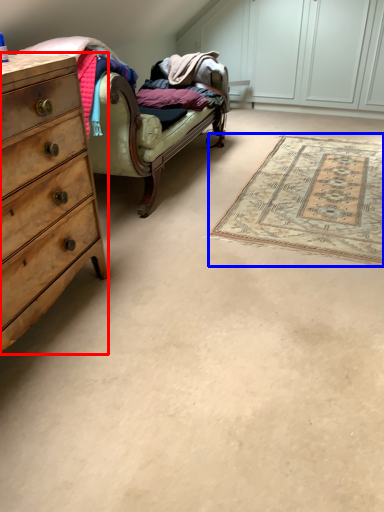
Question: Which point is further to the camera, chest of drawers (highlighted by a red box) or mat (highlighted by a blue box)?

Choices:
 (A) chest of drawers
 (B) mat

Answer: (B)